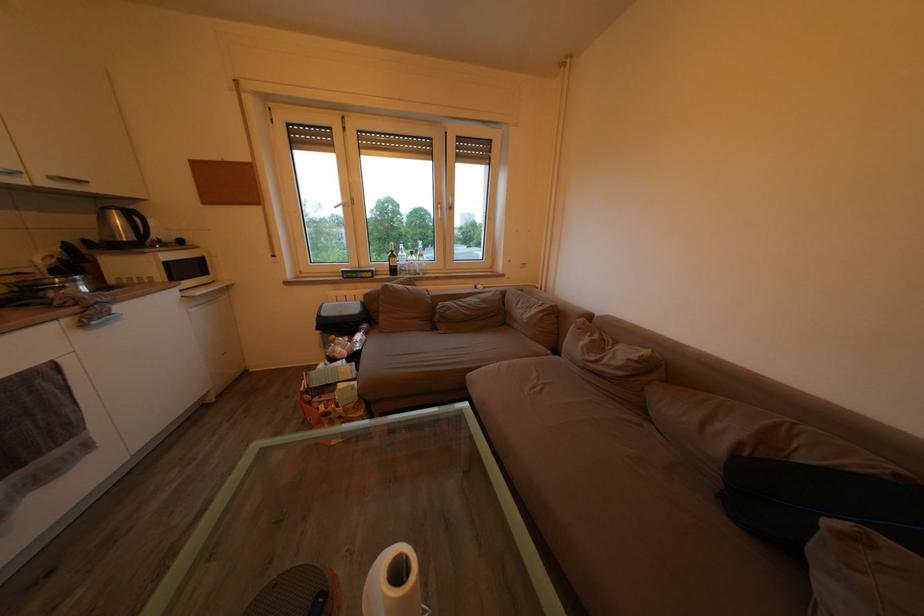
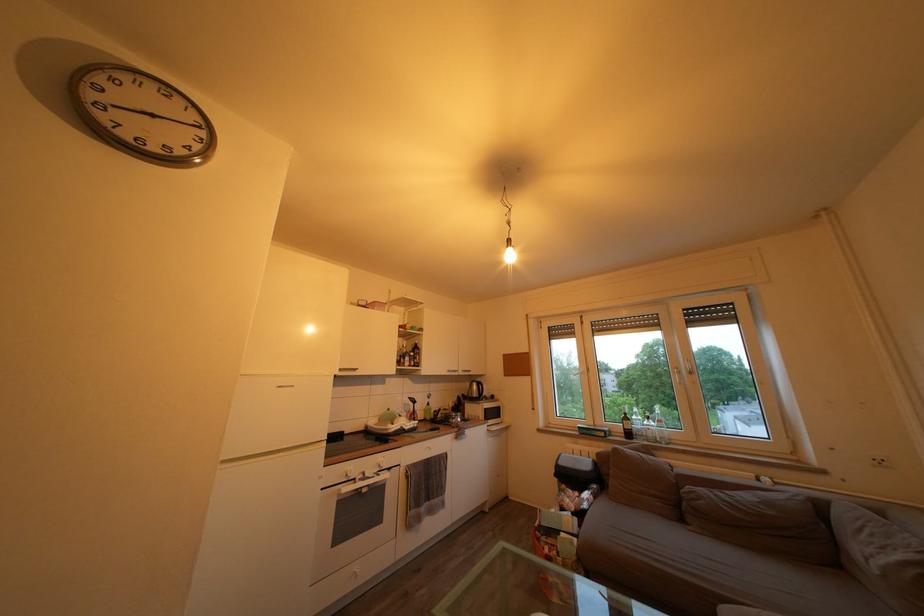
First-person continuous shooting, in which direction is the camera rotating?

The rotation direction of the camera is left-up.